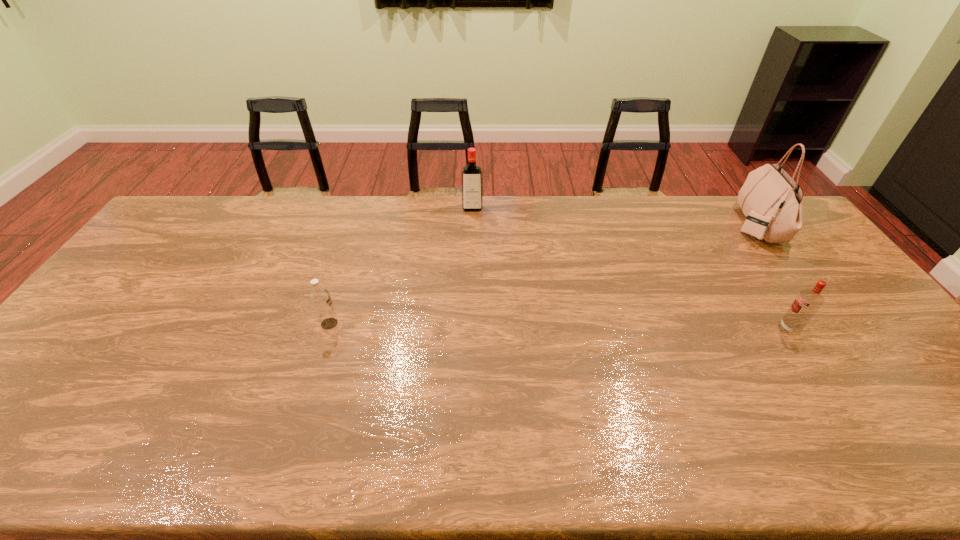
Identify the location of vacant region located 0.060m on the front label of the rightmost vodka. The height and width of the screenshot is (540, 960). (756, 329).

At what (x,y) coordinates should I click in order to perform the action: click on free spot located on the front label of the rightmost vodka. Please return your answer as a coordinate pair (x, y). Looking at the image, I should click on (734, 329).

Find the location of a particular element. The height and width of the screenshot is (540, 960). vacant space located 0.180m on the front label of the rightmost vodka is located at coordinates (713, 329).

Identify the location of vacant area located on the front label of the leftmost object. (386, 323).

Find the location of a particular element. handbag at the far edge is located at coordinates (772, 201).

Find the location of a particular element. This screenshot has height=540, width=960. vodka positioned at the far edge is located at coordinates (471, 174).

In order to click on object positioned at the right edge in this screenshot , I will do `click(772, 201)`.

Where is `object located at the far right corner`? The image size is (960, 540). object located at the far right corner is located at coordinates (772, 201).

You are a GUI agent. You are given a task and a screenshot of the screen. Output one action in this format:
    pyautogui.click(x=<x>, y=<y>)
    Task: Click on the vacant space at the far edge
    Image resolution: width=960 pixels, height=540 pixels.
    Given the screenshot: What is the action you would take?
    pyautogui.click(x=599, y=233)

Identify the location of free space at the near edge. (697, 461).